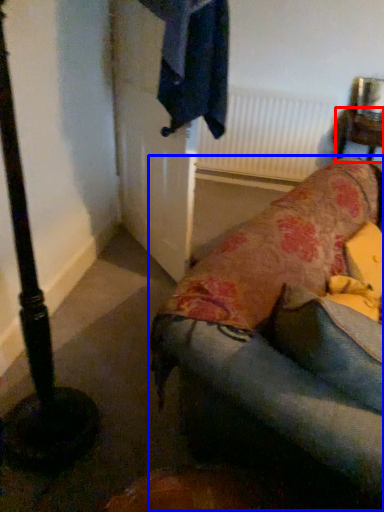
Question: Which object is further to the camera taking this photo, furniture (highlighted by a red box) or studio couch (highlighted by a blue box)?

Choices:
 (A) furniture
 (B) studio couch

Answer: (A)